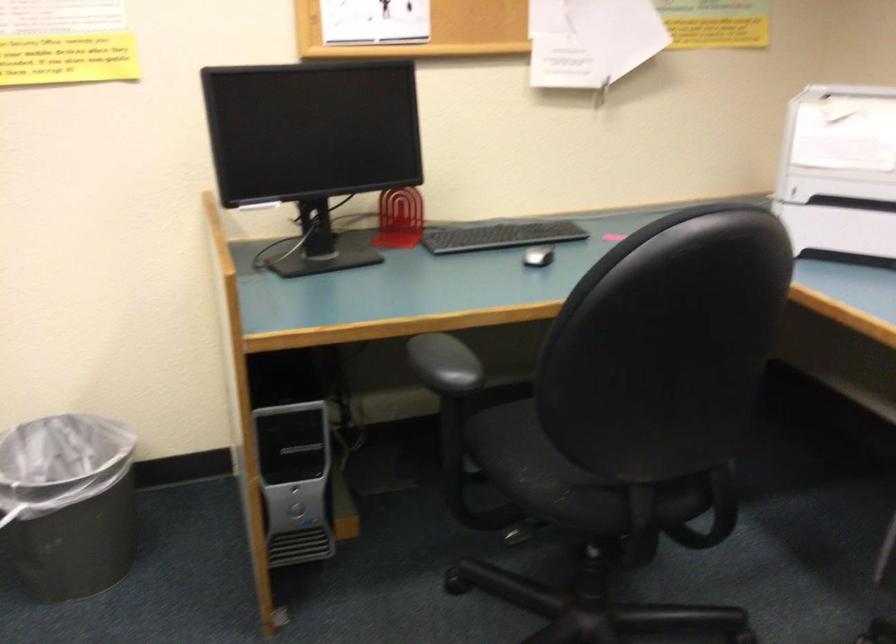
The image size is (896, 644). What are the coordinates of `chair sitting surface` in the screenshot? It's located at (523, 444).